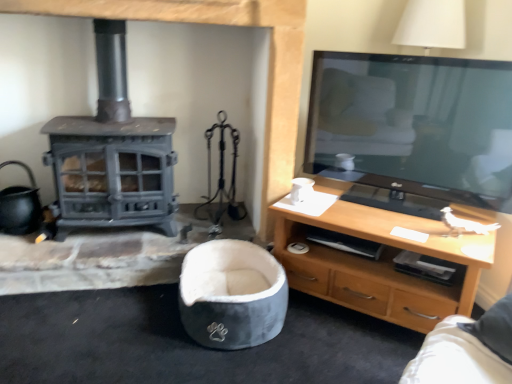
Where is `blank space to the left of velvet grey bean bag chair at center`? The width and height of the screenshot is (512, 384). blank space to the left of velvet grey bean bag chair at center is located at coordinates (124, 326).